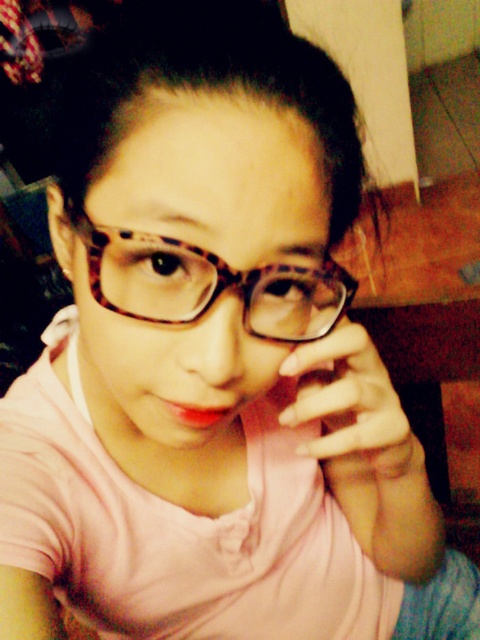
Question: Which of the following is the closest to the observer?

Choices:
 (A) (252, 284)
 (B) (372, 456)

Answer: (A)

Question: Is leopard print glasses at center wider than nail polish at center?

Choices:
 (A) no
 (B) yes

Answer: (B)

Question: Can you confirm if leopard print glasses at center is smaller than nail polish at center?

Choices:
 (A) yes
 (B) no

Answer: (A)

Question: Which of the following is the farthest from the observer?

Choices:
 (A) (283, 294)
 (B) (386, 374)

Answer: (B)

Question: Does leopard print glasses at center have a lesser width compared to nail polish at center?

Choices:
 (A) yes
 (B) no

Answer: (B)